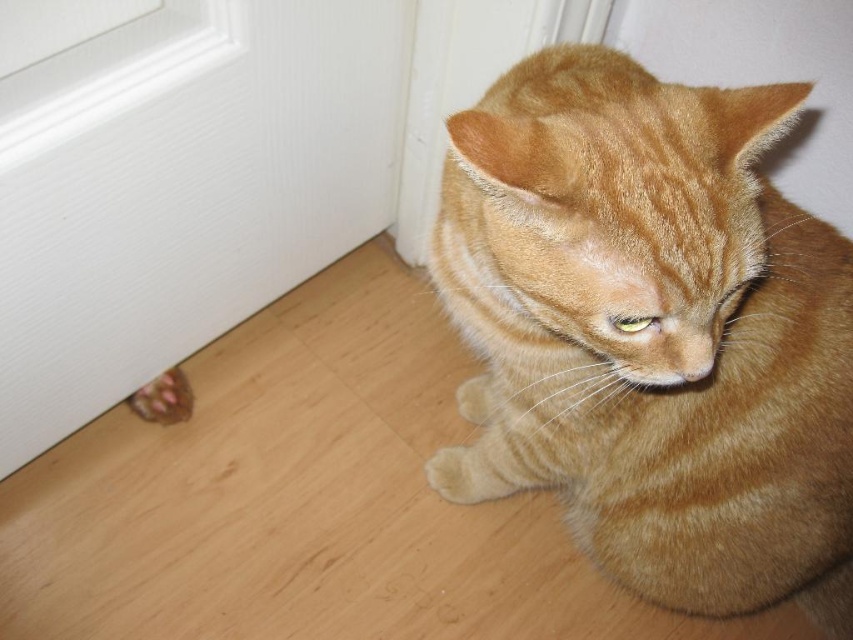
Based on the photo, you are a cat owner who notices your ginger tabby cat sitting near the white textured door at lower left and the brown textured paw at lower left. Which object is closer to the floor?

The brown textured paw at lower left is closer to the floor because it is positioned below the white textured door at lower left.

You are a cat owner who wants to ensure your orange tabby cat at lower right has enough space to stretch comfortably. Given that the brown textured paw at lower left belongs to the same cat, can you determine if the cat is currently in a position where it can stretch its paw fully without obstruction?

The orange tabby cat at lower right is taller than the brown textured paw at lower left, which suggests that the cat has enough vertical space to stretch its paw fully without obstruction.

You are a cat owner who wants to ensure your orange tabby cat at lower right can reach its favorite toy placed near the brown textured paw at lower left. Given that the cat can stretch up to 3 feet, will it be able to reach the toy?

The distance between the orange tabby cat at lower right and the brown textured paw at lower left is 35.09 inches. Since 3 feet equals 36 inches, the cat can comfortably stretch to reach the toy as the distance is slightly less than its maximum reach.